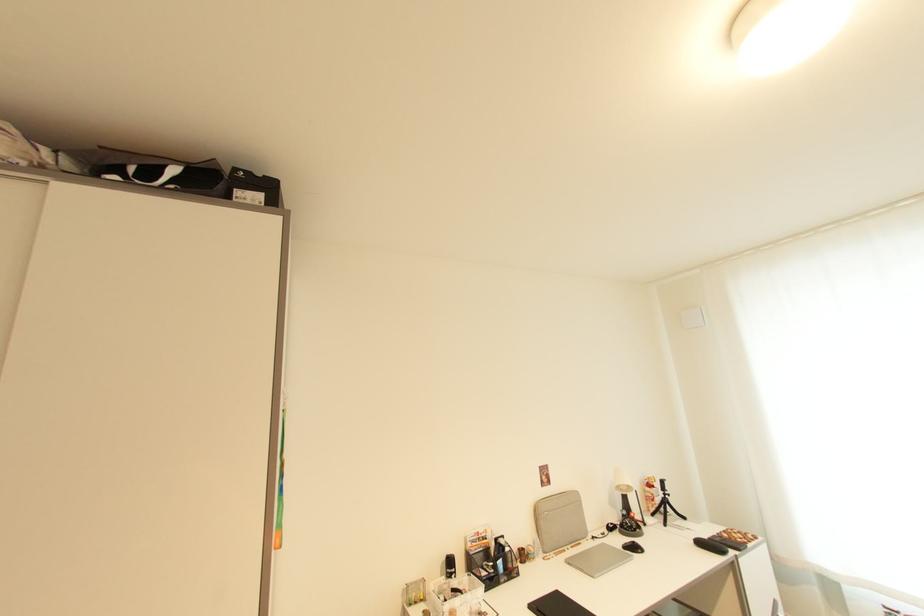
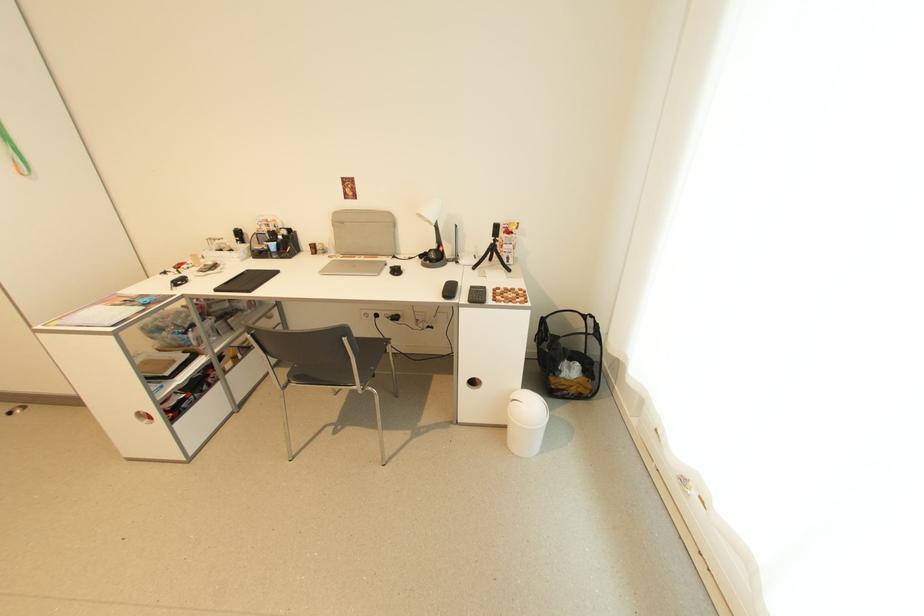
Where in the second image is the point corresponding to pixel 667 493 from the first image?

(497, 238)